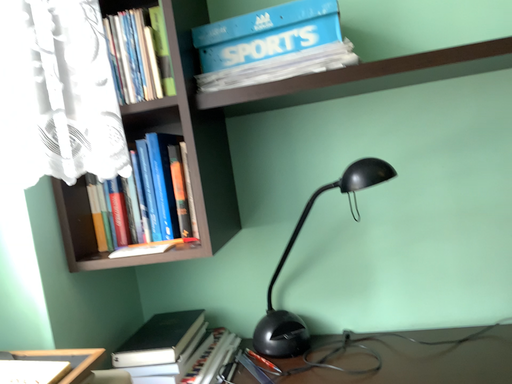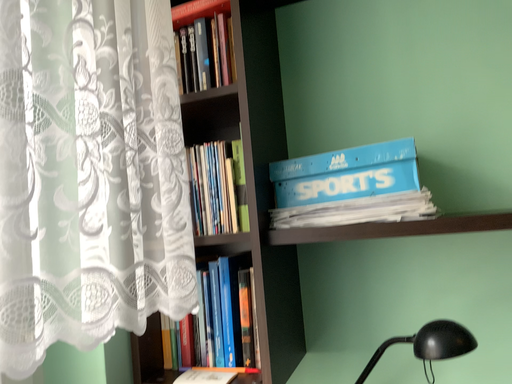
Question: Which way did the camera rotate in the video?

Choices:
 (A) rotated right
 (B) rotated left

Answer: (B)